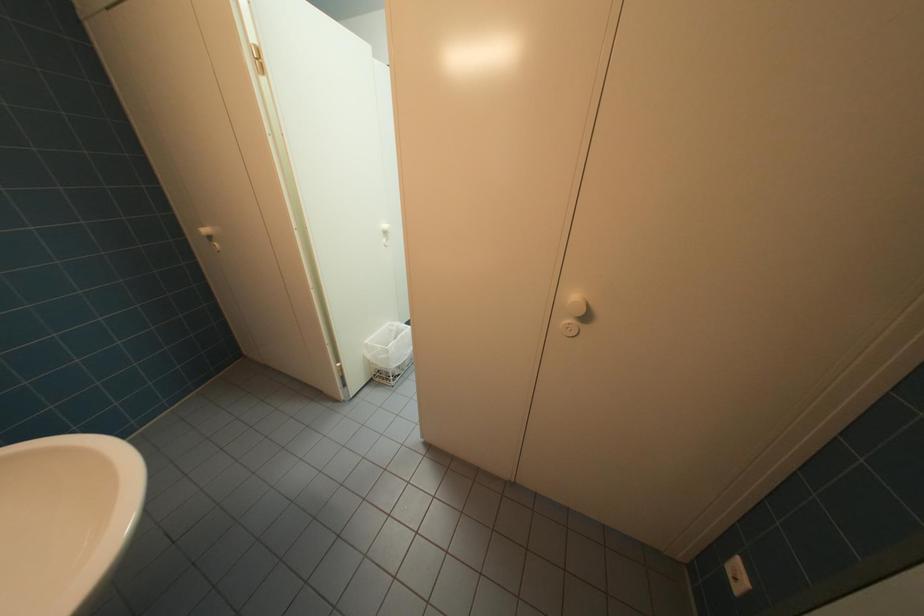
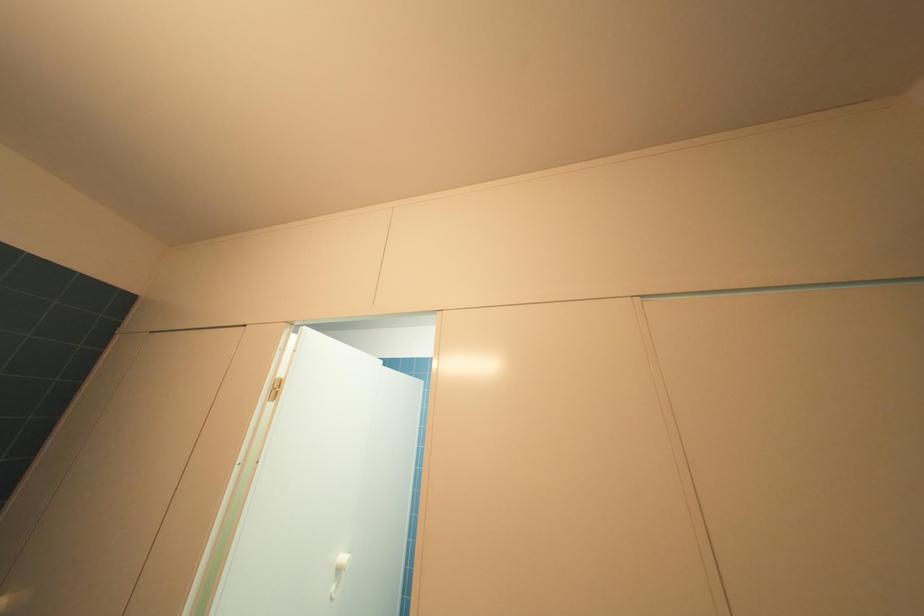
Question: Based on the continuous images, in which direction is the camera rotating? Reply with the corresponding letter.

Choices:
 (A) Left
 (B) Right
 (C) Up
 (D) Down

Answer: (C)